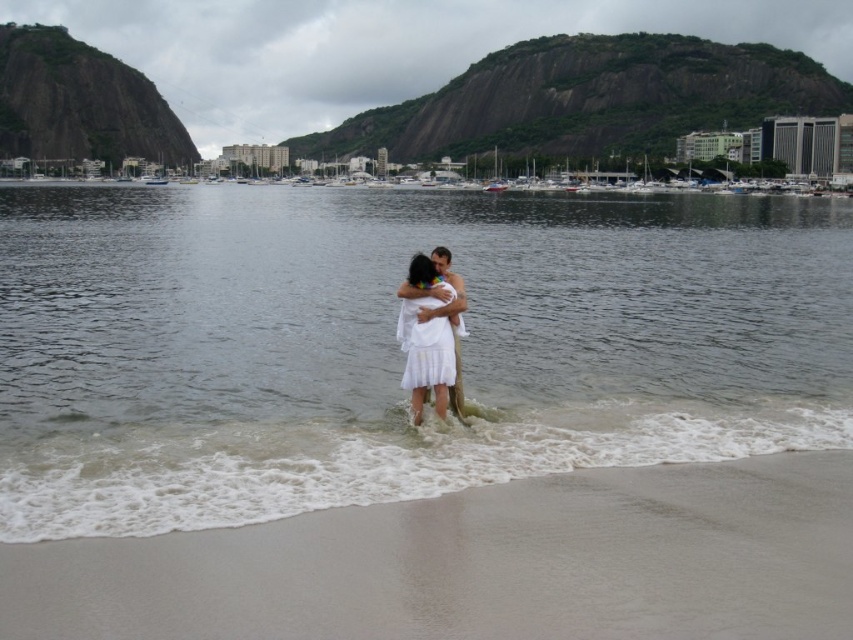
Based on the photo, does clear water at center appear on the right side of sandy beach at lower center?

Incorrect, clear water at center is not on the right side of sandy beach at lower center.

In the scene shown: Can you confirm if clear water at center is thinner than sandy beach at lower center?

In fact, clear water at center might be wider than sandy beach at lower center.

Who is more distant from viewer, (115, 404) or (236, 564)?

Point (115, 404)

Identify the location of clear water at center. (393, 344).

Measure the distance between sandy beach at lower center and camera.

sandy beach at lower center is 15.00 meters from camera.

Can you confirm if sandy beach at lower center is wider than white satin dress at center?

Indeed, sandy beach at lower center has a greater width compared to white satin dress at center.

The image size is (853, 640). Describe the element at coordinates (480, 563) in the screenshot. I see `sandy beach at lower center` at that location.

Locate an element on the screen. This screenshot has width=853, height=640. sandy beach at lower center is located at coordinates (480, 563).

Is clear water at center shorter than white satin dress at center?

No.

Image resolution: width=853 pixels, height=640 pixels. What do you see at coordinates (393, 344) in the screenshot?
I see `clear water at center` at bounding box center [393, 344].

Which is in front, point (675, 218) or point (440, 380)?

Positioned in front is point (440, 380).

You are a GUI agent. You are given a task and a screenshot of the screen. Output one action in this format:
    pyautogui.click(x=<x>, y=<y>)
    Task: Click on the clear water at center
    Image resolution: width=853 pixels, height=640 pixels.
    Given the screenshot: What is the action you would take?
    pyautogui.click(x=393, y=344)